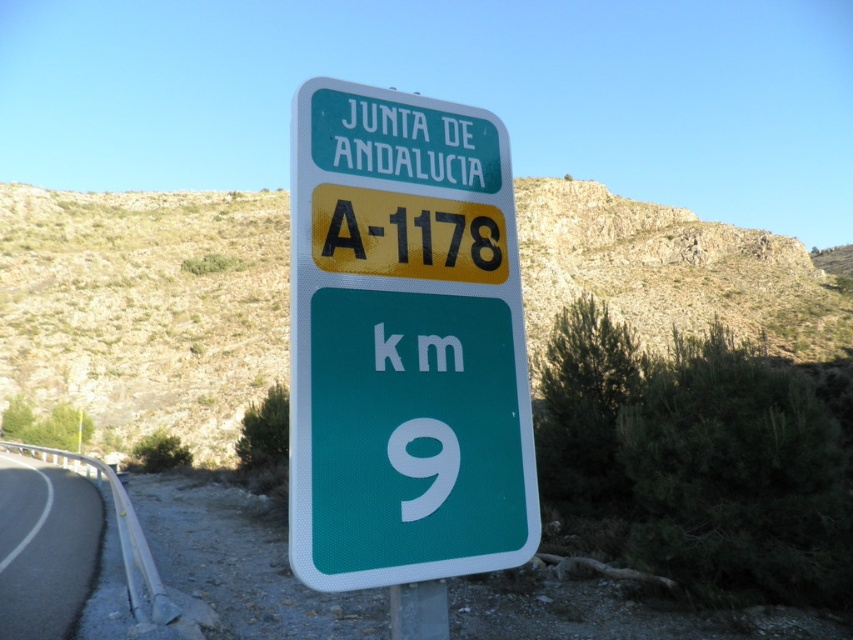
In the scene shown: You are driving along the black asphalt road at lower left and see the green plastic sign at center ahead. Can you determine which object is closer to you based on their sizes?

The green plastic sign at center has a smaller size compared to black asphalt road at lower left, so the black asphalt road at lower left is closer to you.